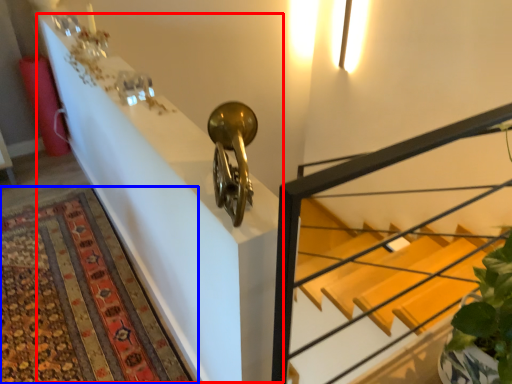
Question: Which object is closer to the camera taking this photo, table (highlighted by a red box) or mat (highlighted by a blue box)?

Choices:
 (A) table
 (B) mat

Answer: (A)